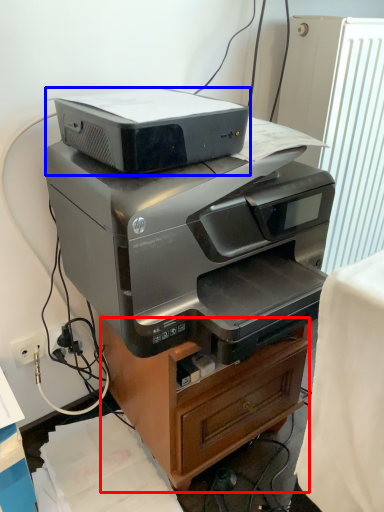
Question: Which point is further to the camera, furniture (highlighted by a red box) or printer (highlighted by a blue box)?

Choices:
 (A) furniture
 (B) printer

Answer: (A)